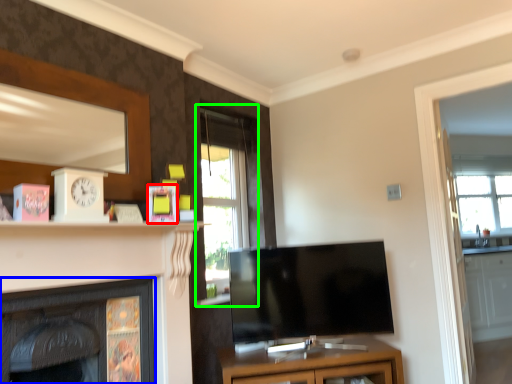
Question: Which is nearer to the picture frame (highlighted by a red box)? fireplace (highlighted by a blue box) or window (highlighted by a green box).

Choices:
 (A) fireplace
 (B) window

Answer: (A)